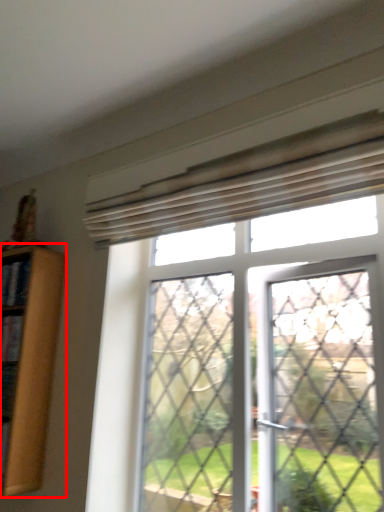
Question: In this image, where is shelf (annotated by the red box) located relative to window?

Choices:
 (A) right
 (B) left

Answer: (B)